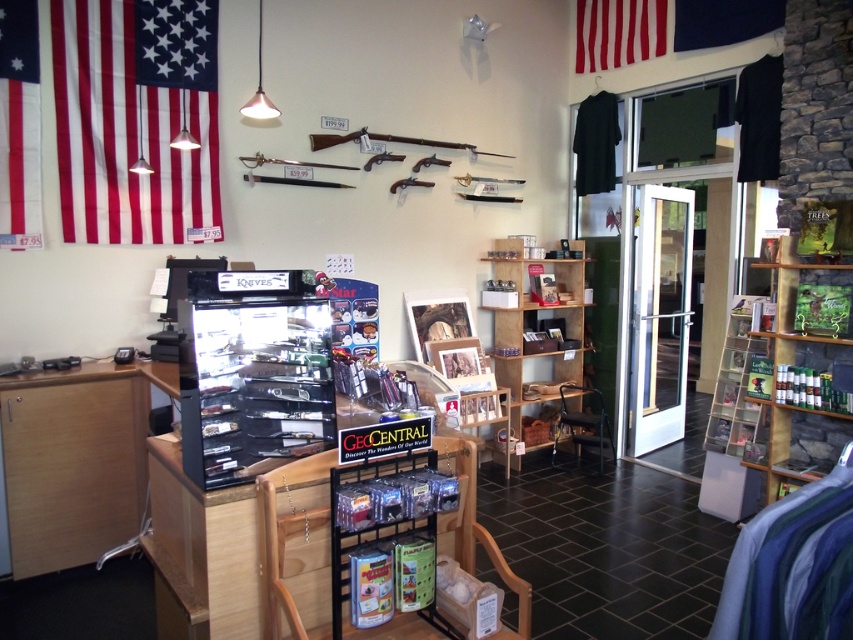
Question: Which of the following is the closest to the observer?

Choices:
 (A) (569, 360)
 (B) (602, 20)
 (C) (775, 17)
 (D) (4, 240)

Answer: (D)

Question: Can you confirm if wooden shelves at center is positioned to the left of red fabric flag at upper left?

Choices:
 (A) no
 (B) yes

Answer: (A)

Question: Can you confirm if red fabric flag at upper left is positioned to the right of red fabric flag at upper center?

Choices:
 (A) no
 (B) yes

Answer: (A)

Question: Which object is positioned farthest from the red/white striped flag at upper left?

Choices:
 (A) red fabric flag at upper left
 (B) blue fabric flag at upper center
 (C) wooden shelves at center
 (D) red fabric flag at upper center

Answer: (B)

Question: Is red fabric flag at upper left wider than red fabric flag at upper center?

Choices:
 (A) yes
 (B) no

Answer: (B)

Question: Which point is closer to the camera?

Choices:
 (A) (36, 180)
 (B) (708, 42)
 (C) (640, 20)
 (D) (554, 381)

Answer: (A)